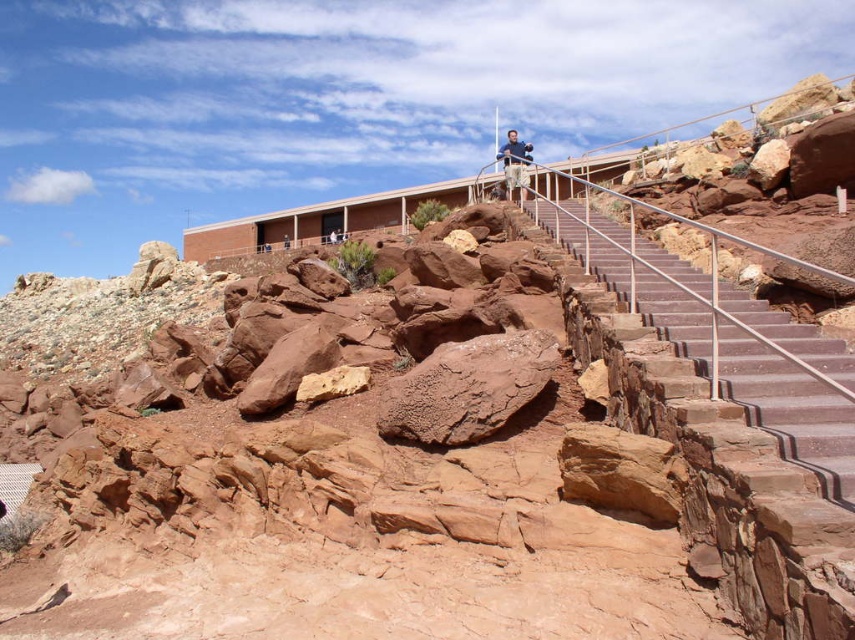
Is point (469, 364) less distant than point (517, 172)?

Yes, point (469, 364) is closer to viewer.

Is rusty rock at center closer to camera compared to tan fabric shirt at upper center?

Yes, rusty rock at center is closer to the viewer.

Where is `rusty rock at center`? rusty rock at center is located at coordinates (467, 387).

Is smooth concrete stairs at center to the right of tan fabric shirt at upper center from the viewer's perspective?

No, smooth concrete stairs at center is not to the right of tan fabric shirt at upper center.

Is the position of smooth concrete stairs at center more distant than that of tan fabric shirt at upper center?

No, smooth concrete stairs at center is in front of tan fabric shirt at upper center.

Does point (699, 273) come behind point (509, 176)?

No.

Where is `smooth concrete stairs at center`? smooth concrete stairs at center is located at coordinates (789, 410).

Can you confirm if smooth concrete stairs at center is bigger than rusty rock at center?

Yes, smooth concrete stairs at center is bigger than rusty rock at center.

Between smooth concrete stairs at center and rusty rock at center, which one is positioned lower?

rusty rock at center is below.

Is point (570, 204) positioned before point (529, 356)?

No.

At what (x,y) coordinates should I click in order to perform the action: click on smooth concrete stairs at center. Please return your answer as a coordinate pair (x, y). Looking at the image, I should click on (789, 410).